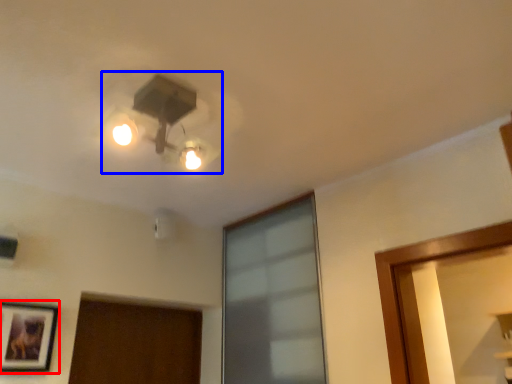
Question: Which object appears closest to the camera in this image, picture frame (highlighted by a red box) or lamp (highlighted by a blue box)?

Choices:
 (A) picture frame
 (B) lamp

Answer: (B)